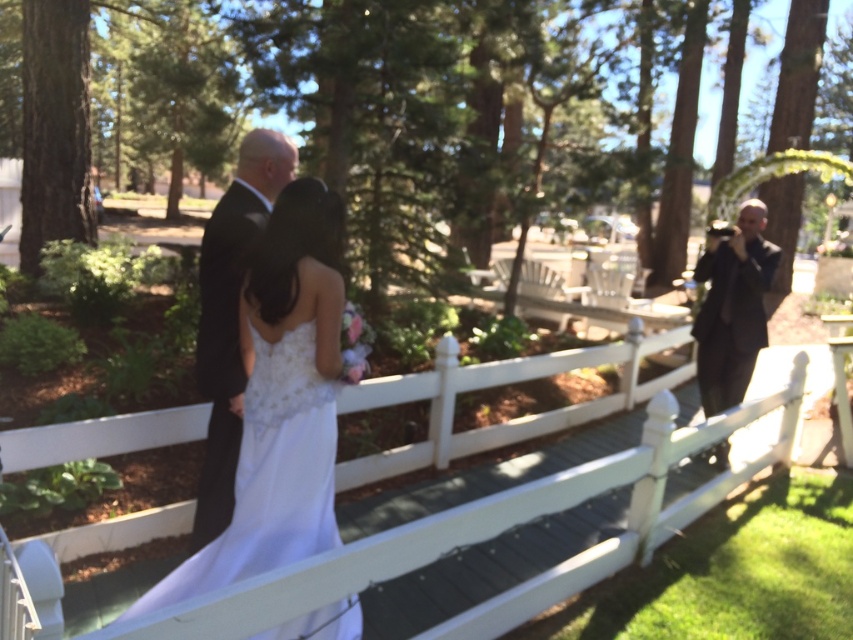
In the scene shown: Does white satin dress at center appear over black suit at right?

Incorrect, white satin dress at center is not positioned above black suit at right.

Who is lower down, white satin dress at center or black suit at right?

Positioned lower is white satin dress at center.

Between point (242, 448) and point (749, 316), which one is positioned in front?

Point (242, 448) is more forward.

This screenshot has width=853, height=640. Identify the location of white satin dress at center. click(x=280, y=401).

Does white wooden fence at center have a smaller size compared to white satin dress at center?

Correct, white wooden fence at center occupies less space than white satin dress at center.

Is white wooden fence at center shorter than white satin dress at center?

Correct, white wooden fence at center is not as tall as white satin dress at center.

What do you see at coordinates (468, 548) in the screenshot? I see `white wooden fence at center` at bounding box center [468, 548].

Identify the location of white wooden fence at center. (468, 548).

Consider the image. Can you confirm if black satin suit at center is shorter than black suit at right?

No.

Identify the location of black satin suit at center. (230, 316).